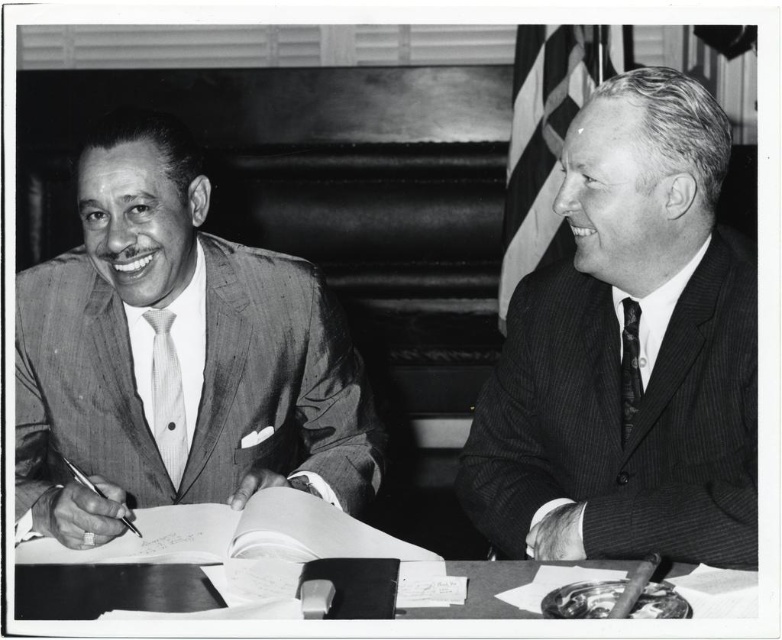
You are a photographer who wants to capture a closeup of both the pinstriped suit at right and the pinstriped fabric tie at left. Since you can only focus on one subject at a time, which one should you choose to ensure the other is still somewhat in focus?

The pinstriped suit at right is closer to the viewer than the pinstriped fabric tie at left. Therefore, focusing on the pinstriped suit at right would keep the pinstriped fabric tie at left in better focus compared to the reverse scenario.

You are a photographer standing 4 feet away from the striped suit at left. Can you take a clear photo of it without moving closer?

The striped suit at left is 3.59 feet away from the camera, which is within the 4 feet distance you are standing. Therefore, you can take a clear photo of the striped suit at left without moving closer.

You are a tailor observing two men in a meeting. You need to determine which item requires more fabric for alterations between the pinstriped suit at right and the pinstriped fabric tie at left. Based on their sizes, which one would need more fabric?

The pinstriped suit at right requires more fabric for alterations since its width is larger than the pinstriped fabric tie at left.